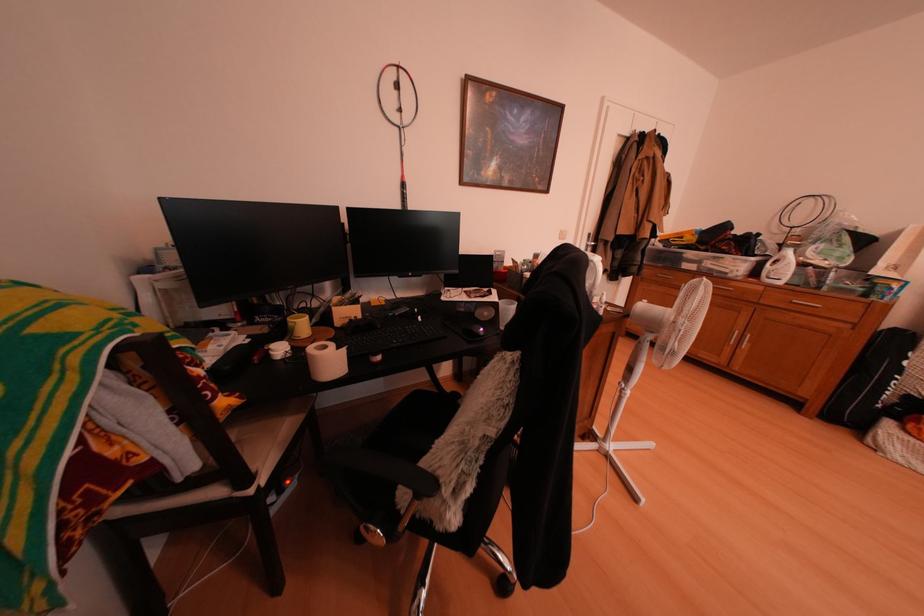
Find where to click the computer mouse. Please return your answer as a coordinate pair (x, y).

(473, 331)